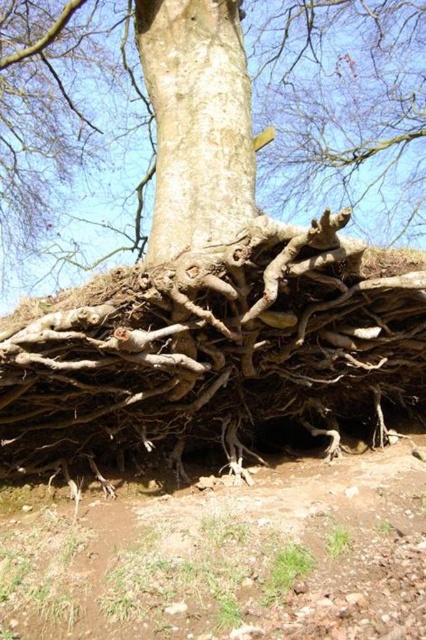
Question: Based on their relative distances, which object is nearer to the brown rough roots at center?

Choices:
 (A) brown soil at lower center
 (B) barky brown roots at center
 (C) smooth brown bark at center

Answer: (A)

Question: Does brown rough roots at center come in front of smooth brown bark at center?

Choices:
 (A) yes
 (B) no

Answer: (A)

Question: Which point appears closest to the camera in this image?

Choices:
 (A) (173, 234)
 (B) (111, 406)
 (C) (336, 131)

Answer: (B)

Question: Does barky brown roots at center have a greater width compared to smooth brown bark at center?

Choices:
 (A) yes
 (B) no

Answer: (B)

Question: Which is nearer to the brown soil at lower center?

Choices:
 (A) brown rough roots at center
 (B) barky brown roots at center

Answer: (A)

Question: From the image, what is the correct spatial relationship of brown soil at lower center in relation to smooth brown bark at center?

Choices:
 (A) left
 (B) right

Answer: (B)